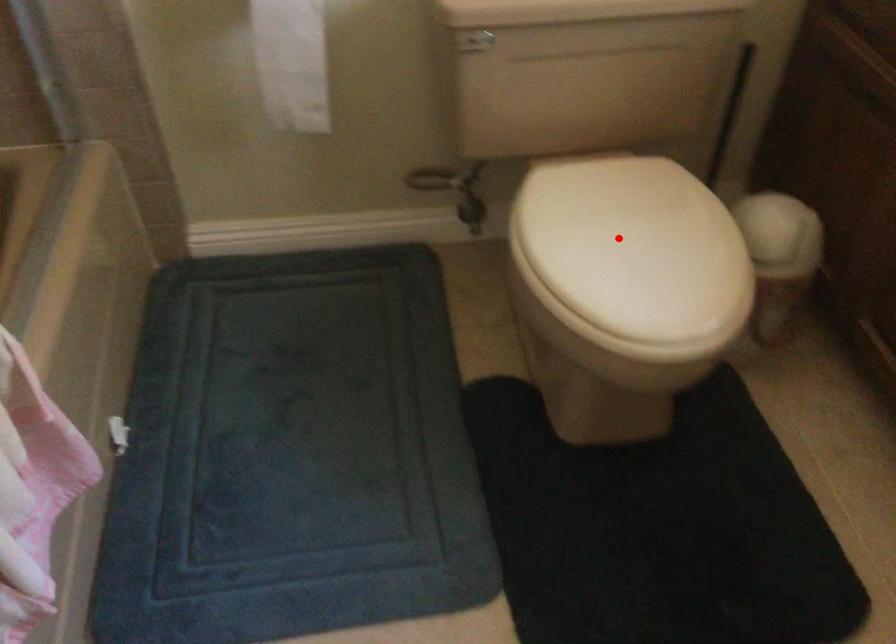
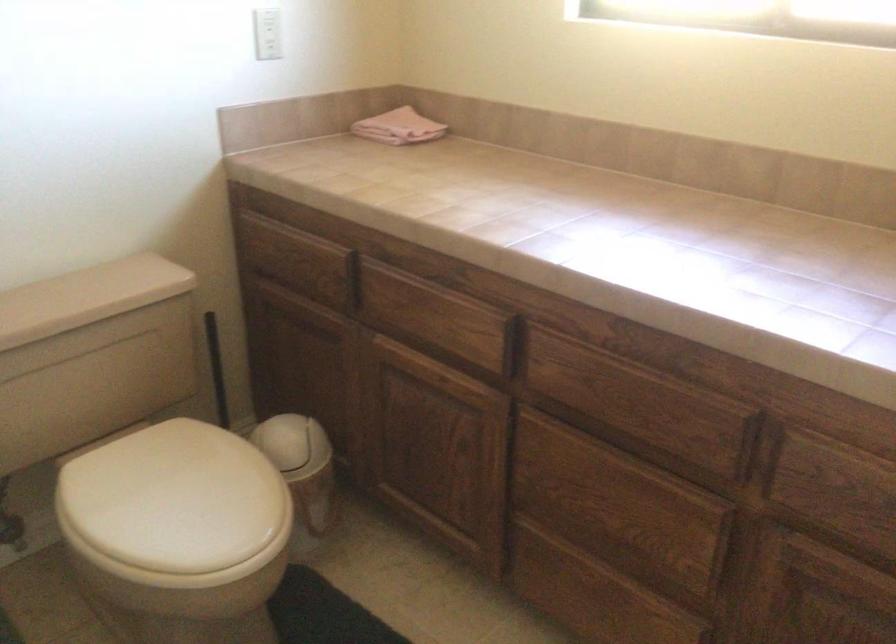
Find the pixel in the second image that matches the highlighted location in the first image.

(176, 500)